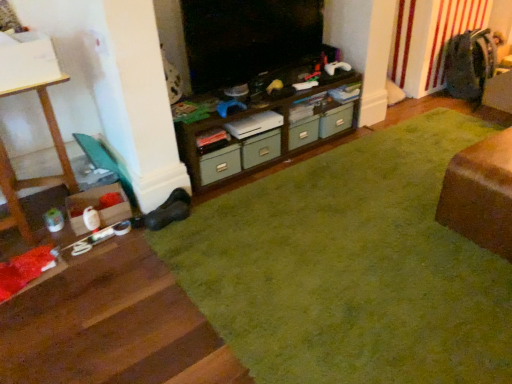
This screenshot has width=512, height=384. What do you see at coordinates (268, 132) in the screenshot?
I see `brown wood cabinet at center` at bounding box center [268, 132].

What do you see at coordinates (321, 126) in the screenshot? I see `green matte drawer at center, placed as the 1th drawer when sorted from right to left` at bounding box center [321, 126].

Where is `brown wood table at lower right`? brown wood table at lower right is located at coordinates (480, 194).

Locate an element on the screen. This screenshot has width=512, height=384. brown wood cabinet at center is located at coordinates point(268,132).

From the image's perspective, which is below, green fabric drawer at center, arranged as the 2th drawer when viewed from the back, or wooden table at left?

wooden table at left.

Based on the photo, considering the positions of objects green fabric drawer at center, the 2th drawer viewed from the right, and wooden table at left in the image provided, who is in front, green fabric drawer at center, the 2th drawer viewed from the right, or wooden table at left?

wooden table at left is in front.

Does green fabric drawer at center, the 2th drawer viewed from the right, turn towards wooden table at left?

No, green fabric drawer at center, the 2th drawer viewed from the right, is not turned towards wooden table at left.

Does point (276, 150) come in front of point (58, 144)?

No, it is behind (58, 144).

In the scene shown: Which point is more forward, (22, 219) or (261, 155)?

The point (22, 219) is closer.

Are wooden table at left and green fabric drawer at center, the first drawer positioned from the front, beside each other?

No, wooden table at left is not in contact with green fabric drawer at center, the first drawer positioned from the front.

Visually, is wooden table at left positioned to the left or to the right of green fabric drawer at center, the 2th drawer viewed from the right?

wooden table at left is positioned on green fabric drawer at center, the 2th drawer viewed from the right,'s left side.

Choose the correct answer: Is brown wood table at lower right inside green carpet at center or outside it?

brown wood table at lower right is not enclosed by green carpet at center.

Is brown wood table at lower right facing towards green carpet at center?

Yes, brown wood table at lower right is aimed at green carpet at center.

Can you confirm if brown wood table at lower right is smaller than green carpet at center?

Indeed, brown wood table at lower right has a smaller size compared to green carpet at center.

Is brown wood table at lower right positioned in front of green carpet at center?

No, brown wood table at lower right is behind green carpet at center.

Could you tell me if brown wood cabinet at center is facing green matte drawer at center, the first drawer viewed from the back?

Yes, brown wood cabinet at center is turned towards green matte drawer at center, the first drawer viewed from the back.

Considering the relative sizes of brown wood cabinet at center and green matte drawer at center, which is the 2th drawer in front-to-back order, in the image provided, is brown wood cabinet at center shorter than green matte drawer at center, which is the 2th drawer in front-to-back order,?

No, brown wood cabinet at center is not shorter than green matte drawer at center, which is the 2th drawer in front-to-back order.

Between brown wood cabinet at center and green matte drawer at center, placed as the 1th drawer when sorted from right to left, which one is positioned in front?

brown wood cabinet at center is closer to the camera.

Are brown wood cabinet at center and green matte drawer at center, the second drawer positioned from the left, far apart?

Actually, brown wood cabinet at center and green matte drawer at center, the second drawer positioned from the left, are a little close together.

Which object is more forward, green carpet at center or green matte drawer at center, the second drawer positioned from the left?

green carpet at center is closer to the camera.

Would you say green carpet at center is to the left or to the right of green matte drawer at center, which is the 2th drawer in front-to-back order, in the picture?

Based on their positions, green carpet at center is located to the right of green matte drawer at center, which is the 2th drawer in front-to-back order.

Is green carpet at center smaller than green matte drawer at center, the first drawer viewed from the back?

No, green carpet at center is not smaller than green matte drawer at center, the first drawer viewed from the back.

Consider the image. Looking at their sizes, would you say green carpet at center is wider or thinner than green matte drawer at center, the first drawer viewed from the back?

Clearly, green carpet at center has more width compared to green matte drawer at center, the first drawer viewed from the back.

From a real-world perspective, between brown wood cabinet at center and green fabric drawer at center, arranged as the 2th drawer when viewed from the back, who is vertically higher?

brown wood cabinet at center is physically above.

Is point (276, 129) in front of point (278, 153)?

Yes, it is in front of point (278, 153).

Is brown wood cabinet at center looking in the opposite direction of green fabric drawer at center, arranged as the 2th drawer when viewed from the back?

Correct, brown wood cabinet at center is looking away from green fabric drawer at center, arranged as the 2th drawer when viewed from the back.

Consider the image. Is brown wood cabinet at center directly adjacent to green fabric drawer at center, the first drawer positioned from the front?

brown wood cabinet at center and green fabric drawer at center, the first drawer positioned from the front, are not in contact.

From a real-world perspective, is wooden table at left positioned under green matte drawer at center, the first drawer viewed from the back, based on gravity?

Actually, wooden table at left is physically above green matte drawer at center, the first drawer viewed from the back, in the real world.

What's the angular difference between wooden table at left and green matte drawer at center, the first drawer viewed from the back,'s facing directions?

1.26 degrees separate the facing orientations of wooden table at left and green matte drawer at center, the first drawer viewed from the back.

Does wooden table at left have a greater width compared to green matte drawer at center, which is the 2th drawer in front-to-back order?

Indeed, wooden table at left has a greater width compared to green matte drawer at center, which is the 2th drawer in front-to-back order.

In the image, is wooden table at left on the left side or the right side of green matte drawer at center, which is the 2th drawer in front-to-back order?

In the image, wooden table at left appears on the left side of green matte drawer at center, which is the 2th drawer in front-to-back order.

I want to click on the 1st drawer counting from the right of the wooden table at left, so click(x=261, y=149).

Find the location of a particular element. The image size is (512, 384). furniture below the green fabric drawer at center, arranged as the 2th drawer when viewed from the back (from the image's perspective) is located at coordinates (33, 178).

When comparing their distances from wooden table at left, does green carpet at center or green fabric drawer at center, arranged as the 2th drawer when viewed from the back, seem closer?

green fabric drawer at center, arranged as the 2th drawer when viewed from the back, is positioned closer to the anchor wooden table at left.

From the image, which object appears to be nearer to brown wood table at lower right, green fabric drawer at center, arranged as the 2th drawer when viewed from the back, or green carpet at center?

Among the two, green carpet at center is located nearer to brown wood table at lower right.

Looking at the image, which one is located further to green carpet at center, wooden table at left or green matte drawer at center, the second drawer positioned from the left?

The object further to green carpet at center is wooden table at left.

When comparing their distances from brown wood table at lower right, does green fabric drawer at center, arranged as the 2th drawer when viewed from the back, or brown wood cabinet at center seem closer?

brown wood cabinet at center is closer to brown wood table at lower right.

In the scene shown: From the image, which object appears to be farther from brown wood cabinet at center, brown wood table at lower right or green matte drawer at center, the second drawer positioned from the left?

Among the two, brown wood table at lower right is located further to brown wood cabinet at center.

From the image, which object appears to be farther from wooden table at left, brown wood table at lower right or green matte drawer at center, the first drawer viewed from the back?

brown wood table at lower right is further to wooden table at left.

When comparing their distances from green carpet at center, does brown wood table at lower right or wooden table at left seem further?

wooden table at left is positioned further to the anchor green carpet at center.

Which object lies nearer to the anchor point green fabric drawer at center, the first drawer positioned from the front, wooden table at left or brown wood cabinet at center?

brown wood cabinet at center is positioned closer to the anchor green fabric drawer at center, the first drawer positioned from the front.

Locate an element on the screen. The height and width of the screenshot is (384, 512). drawer between wooden table at left and green matte drawer at center, the second drawer positioned from the left, in the horizontal direction is located at coordinates (261, 149).

Locate an element on the screen. drawer located between green fabric drawer at center, the first drawer positioned from the front, and brown wood table at lower right in the left-right direction is located at coordinates (321, 126).

This screenshot has width=512, height=384. In order to click on cabinetry between green fabric drawer at center, the first drawer positioned from the front, and brown wood table at lower right, in the horizontal direction in this screenshot , I will do `click(268, 132)`.

You are a GUI agent. You are given a task and a screenshot of the screen. Output one action in this format:
    pyautogui.click(x=<x>, y=<y>)
    Task: Click on the table between green carpet at center and green fabric drawer at center, the first drawer positioned from the front, in the front-back direction
    
    Given the screenshot: What is the action you would take?
    pyautogui.click(x=480, y=194)